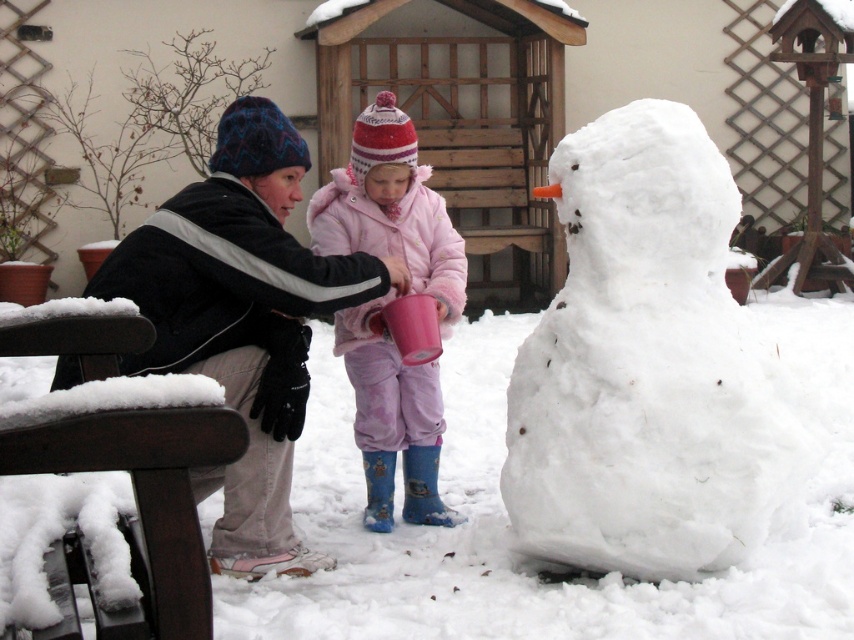
Question: Is white fluffy snowman at right above black fleece jacket at left?

Choices:
 (A) no
 (B) yes

Answer: (B)

Question: Which point is closer to the camera?

Choices:
 (A) pink fleece coat at center
 (B) white fluffy snowman at right

Answer: (B)

Question: Can you confirm if black fleece jacket at left is positioned to the left of pink fleece coat at center?

Choices:
 (A) yes
 (B) no

Answer: (A)

Question: Which object is the farthest from the black fleece jacket at left?

Choices:
 (A) pink fleece coat at center
 (B) white fluffy snowman at right

Answer: (B)

Question: Does white fluffy snowman at right have a smaller size compared to black fleece jacket at left?

Choices:
 (A) yes
 (B) no

Answer: (A)

Question: Which of the following is the closest to the observer?

Choices:
 (A) black fleece jacket at left
 (B) white fluffy snowman at right
 (C) pink fleece coat at center

Answer: (A)